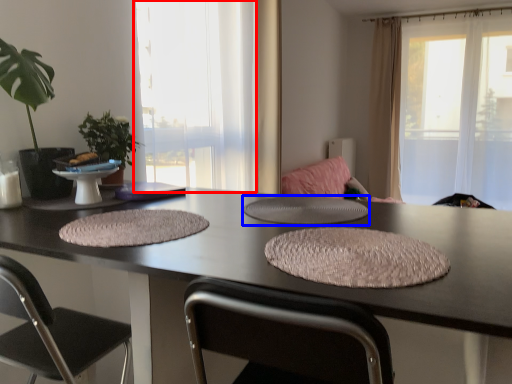
Question: Which object appears farthest to the camera in this image, window (highlighted by a red box) or round table (highlighted by a blue box)?

Choices:
 (A) window
 (B) round table

Answer: (A)